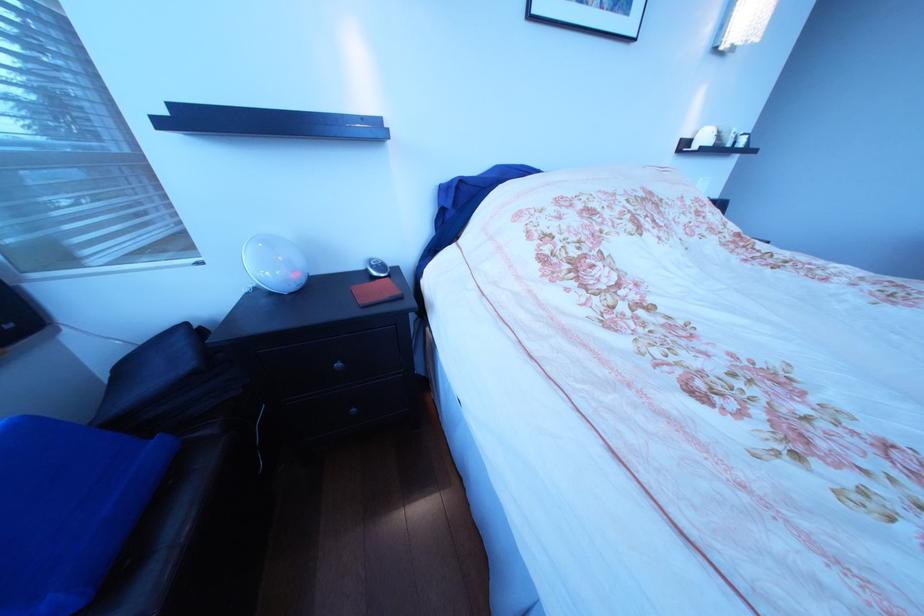
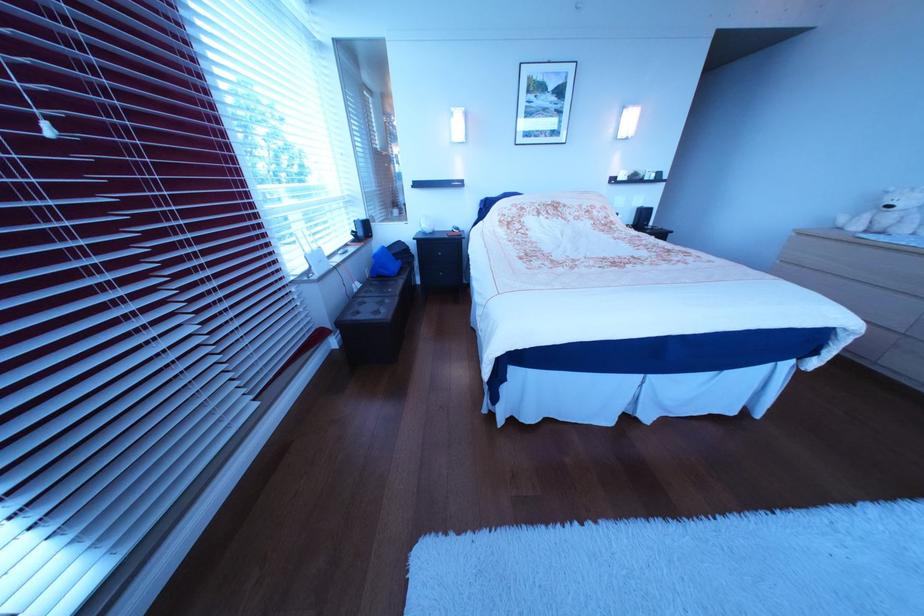
Locate, in the second image, the point that corresponds to point 309,290 in the first image.

(445, 233)